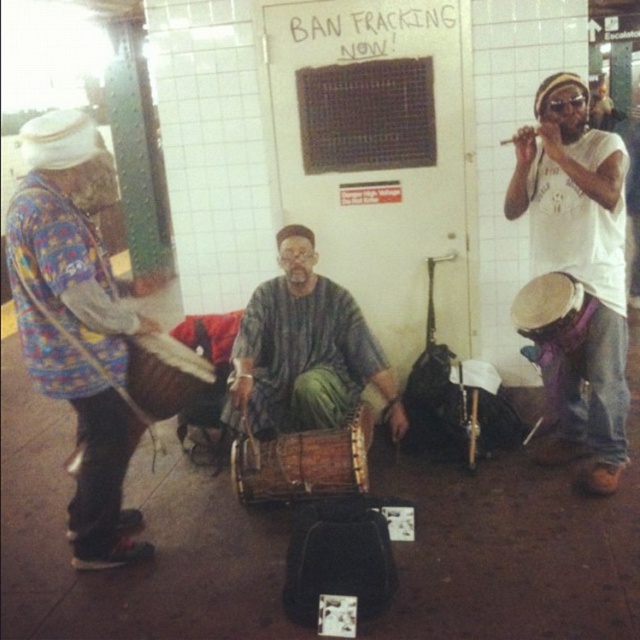
Can you confirm if purple fabric drum at right is smaller than textured brown drum at center?

No.

Identify the location of purple fabric drum at right. The width and height of the screenshot is (640, 640). pos(580,260).

Is point (600, 157) positioned after point (360, 344)?

No, (600, 157) is in front of (360, 344).

At what (x,y) coordinates should I click in order to perform the action: click on purple fabric drum at right. Please return your answer as a coordinate pair (x, y). This screenshot has width=640, height=640. Looking at the image, I should click on [580, 260].

Which of these two, textured brown drum at center or brown textured drum at center, stands shorter?

brown textured drum at center

Between point (260, 310) and point (314, 451), which one is positioned in front?

Point (314, 451) is in front.

Where is `textured brown drum at center`? The height and width of the screenshot is (640, 640). textured brown drum at center is located at coordinates (305, 349).

Does multicolored fabric drum at left appear on the right side of purple fabric drum at right?

No, multicolored fabric drum at left is not to the right of purple fabric drum at right.

From the picture: Which is more to the left, multicolored fabric drum at left or purple fabric drum at right?

multicolored fabric drum at left

Is point (81, 429) in front of point (618, 456)?

Yes.

Locate an element on the screen. This screenshot has width=640, height=640. multicolored fabric drum at left is located at coordinates (77, 323).